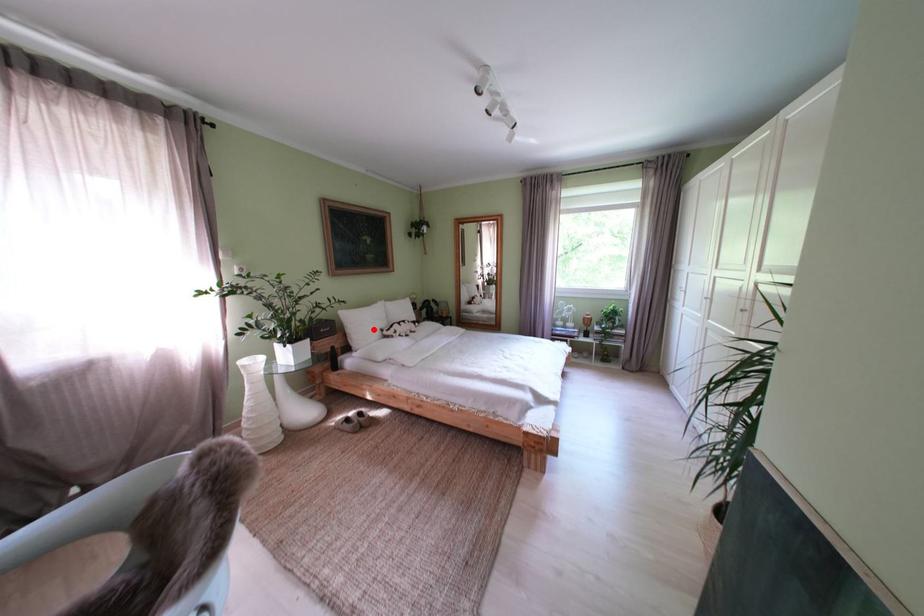
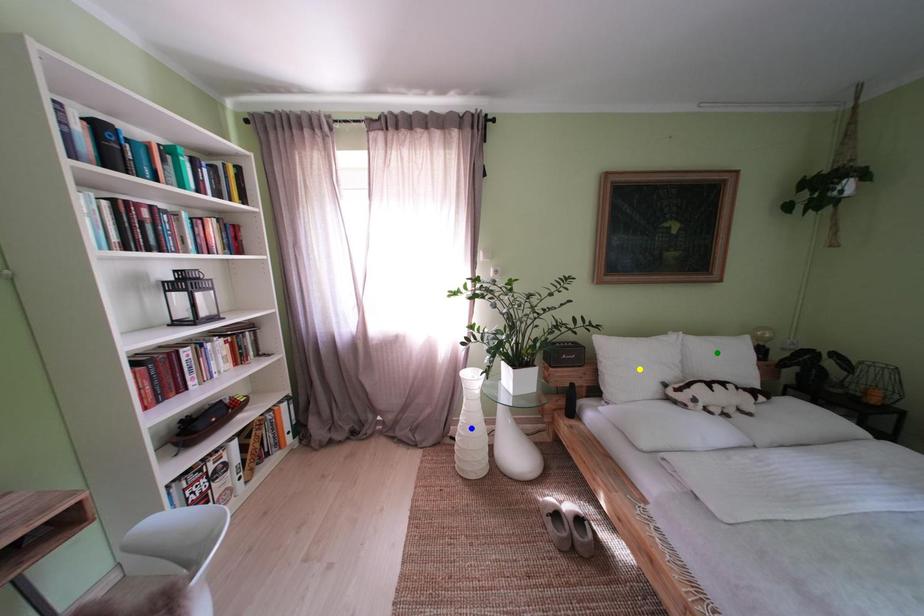
Question: I am providing you with two images of the same scene from different viewpoints. A red point is marked on the first image. You are given multiple points on the second image. Which point in image 2 represents the same 3d spot as the red point in image 1?

Choices:
 (A) yellow point
 (B) blue point
 (C) green point

Answer: (A)